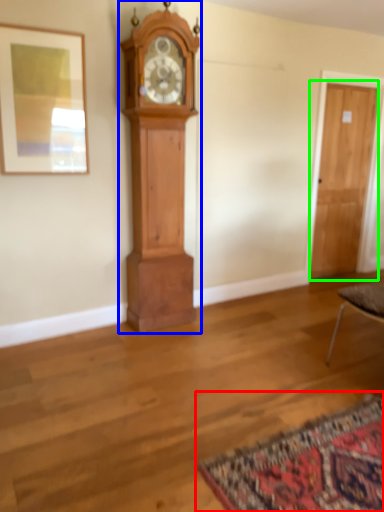
Question: Which is nearer to the mat (highlighted by a red box)? wall clock (highlighted by a blue box) or door (highlighted by a green box).

Choices:
 (A) wall clock
 (B) door

Answer: (A)